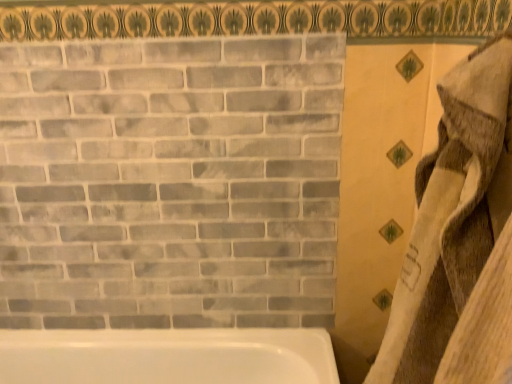
Describe the element at coordinates (459, 238) in the screenshot. This screenshot has width=512, height=384. I see `beige textured towel at right` at that location.

Locate an element on the screen. Image resolution: width=512 pixels, height=384 pixels. beige textured towel at right is located at coordinates coord(459,238).

The height and width of the screenshot is (384, 512). In order to click on beige textured towel at right in this screenshot , I will do `click(459, 238)`.